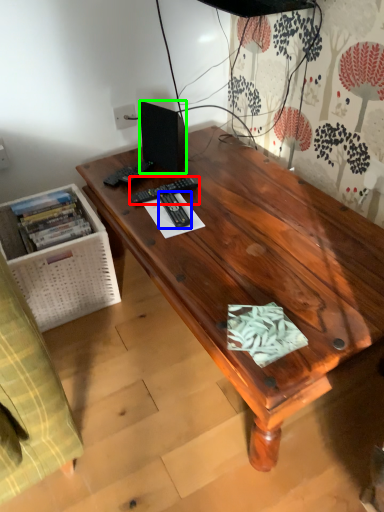
Question: Considering the real-world distances, which object is farthest from remote control (highlighted by a red box)? remote control (highlighted by a blue box) or loudspeaker (highlighted by a green box)?

Choices:
 (A) remote control
 (B) loudspeaker

Answer: (B)